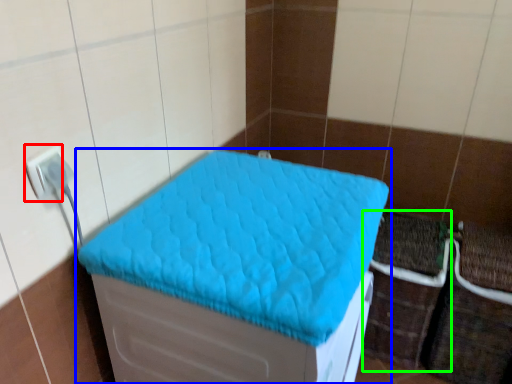
Question: Considering the real-world distances, which object is farthest from electric outlet (highlighted by a red box)? furniture (highlighted by a blue box) or crate (highlighted by a green box)?

Choices:
 (A) furniture
 (B) crate

Answer: (B)